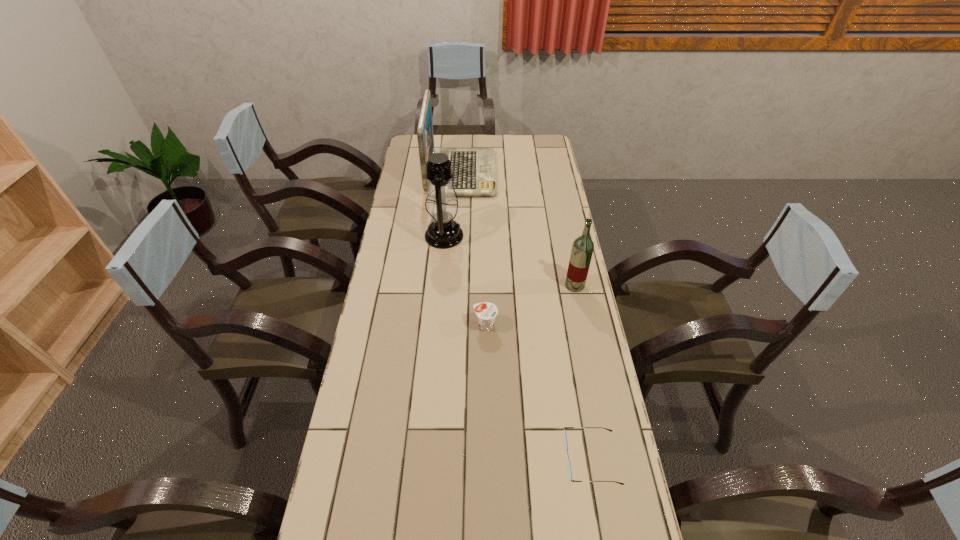
Find the location of a particular element. object that is the second closest to the laptop computer is located at coordinates (582, 249).

Where is `vacant point that satisfies the following two spatial constraints: 1. on the front side of the liquor; 2. on the lenses of the nearest object`? vacant point that satisfies the following two spatial constraints: 1. on the front side of the liquor; 2. on the lenses of the nearest object is located at coordinates (610, 458).

Image resolution: width=960 pixels, height=540 pixels. I want to click on free spot that satisfies the following two spatial constraints: 1. on the screen of the laptop computer; 2. on the back side of the yogurt, so click(453, 326).

Identify the location of free space that satisfies the following two spatial constraints: 1. on the front side of the third farthest object; 2. on the left side of the oil lamp. click(440, 285).

Locate an element on the screen. vacant space that satisfies the following two spatial constraints: 1. on the front side of the liquor; 2. on the left side of the oil lamp is located at coordinates (440, 285).

Where is `free space that satisfies the following two spatial constraints: 1. on the back side of the fourth farthest object; 2. on the screen of the laptop computer`? free space that satisfies the following two spatial constraints: 1. on the back side of the fourth farthest object; 2. on the screen of the laptop computer is located at coordinates (484, 173).